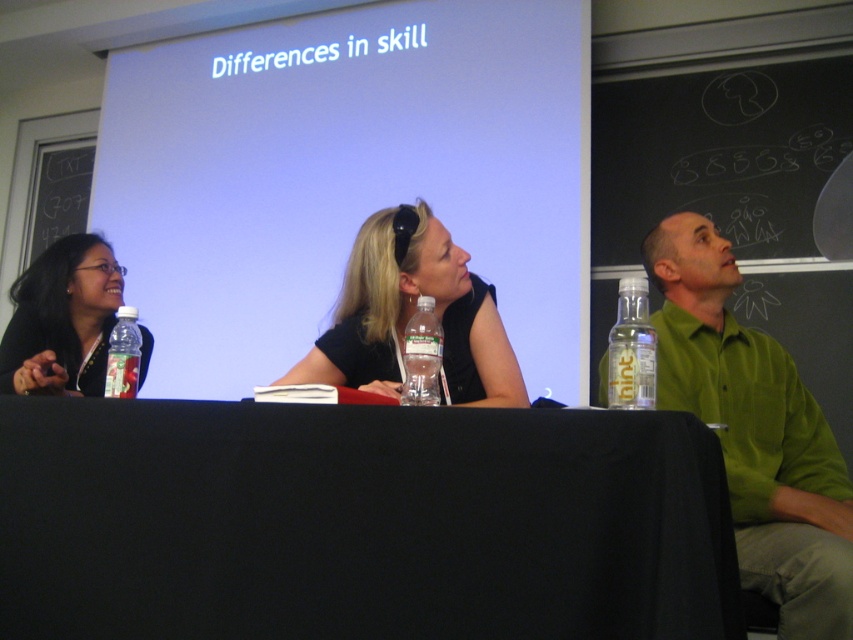
Is green matte shirt at right thinner than clear plastic bottle at right?

No.

Is green matte shirt at right behind clear plastic bottle at right?

That is True.

This screenshot has width=853, height=640. Find the location of `green matte shirt at right`. green matte shirt at right is located at coordinates (755, 433).

Can you confirm if black fabric table at center is shorter than green matte shirt at right?

Yes, black fabric table at center is shorter than green matte shirt at right.

The image size is (853, 640). Find the location of `black fabric table at center`. black fabric table at center is located at coordinates (358, 522).

What do you see at coordinates (358, 522) in the screenshot? I see `black fabric table at center` at bounding box center [358, 522].

Locate an element on the screen. The width and height of the screenshot is (853, 640). black fabric table at center is located at coordinates (358, 522).

Consider the image. Who is positioned more to the right, white matte projection screen at upper center or black matte shirt at center?

black matte shirt at center

Which is behind, point (492, 60) or point (416, 273)?

Point (492, 60)

The width and height of the screenshot is (853, 640). I want to click on white matte projection screen at upper center, so click(347, 177).

This screenshot has width=853, height=640. In order to click on white matte projection screen at upper center in this screenshot , I will do (347, 177).